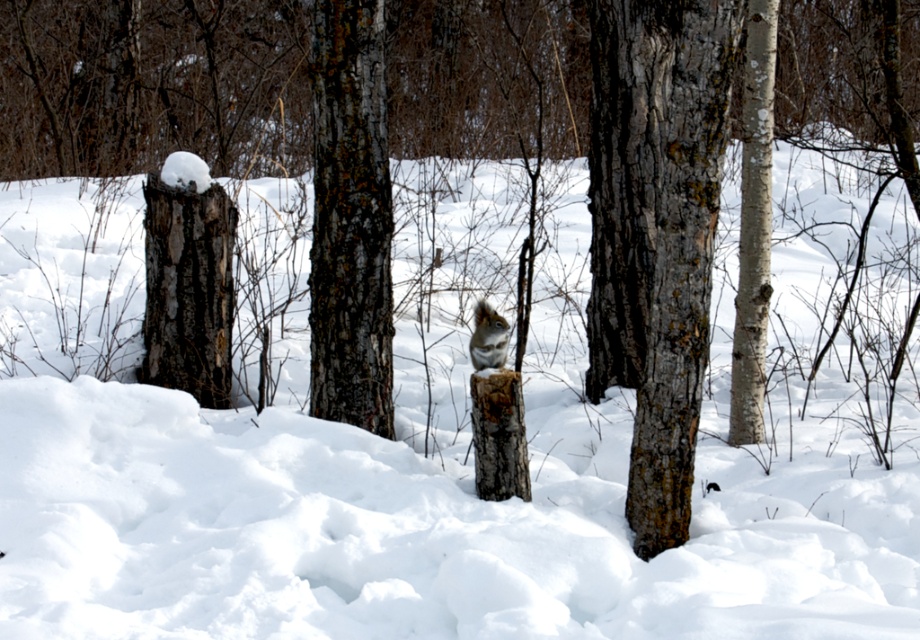
Is grayish-brown bark tree trunk at center below speckled bark tree trunk at center?

Correct, grayish-brown bark tree trunk at center is located below speckled bark tree trunk at center.

Is grayish-brown bark tree trunk at center to the left of speckled bark tree trunk at center from the viewer's perspective?

In fact, grayish-brown bark tree trunk at center is to the right of speckled bark tree trunk at center.

Where is `grayish-brown bark tree trunk at center`? grayish-brown bark tree trunk at center is located at coordinates (656, 232).

Who is more distant from viewer, (757, 236) or (500, 356)?

The point (757, 236) is behind.

Consider the image. Does white bark tree at right appear over fuzzy brown squirrel at center?

Correct, white bark tree at right is located above fuzzy brown squirrel at center.

What do you see at coordinates (753, 227) in the screenshot?
I see `white bark tree at right` at bounding box center [753, 227].

Locate an element on the screen. white bark tree at right is located at coordinates (753, 227).

Who is more distant from viewer, (332, 131) or (489, 326)?

The point (332, 131) is more distant.

Between speckled bark tree trunk at center and fuzzy brown squirrel at center, which one is positioned lower?

fuzzy brown squirrel at center

Is point (337, 240) closer to viewer compared to point (470, 353)?

No, it is not.

Find the location of a particular element. The image size is (920, 640). speckled bark tree trunk at center is located at coordinates (351, 218).